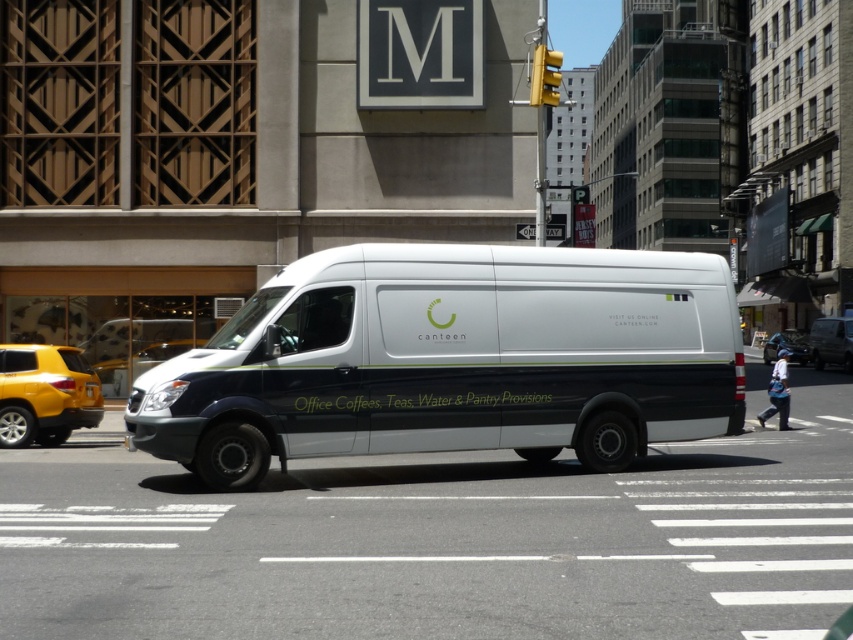
You are standing on the sidewalk in front of the white van parked at the crosswalk. You need to cross the street to reach the building with the large letter M on its facade. There is a yellow matte suv at left blocking your path. Can you safely walk around the suv to reach the building without getting too close to the street?

The yellow matte suv at left is 18.68 meters from the viewer, which is a safe distance to walk around while staying close to the sidewalk and avoiding the street. You can safely navigate around the suv to reach the building with the large letter M on its facade.